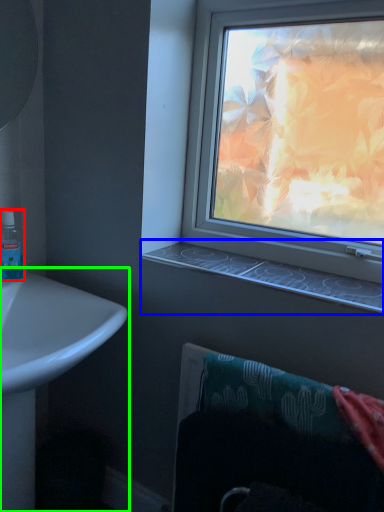
Question: Which is farther away from mouthwash (highlighted by a red box)? window sill (highlighted by a blue box) or sink (highlighted by a green box)?

Choices:
 (A) window sill
 (B) sink

Answer: (A)